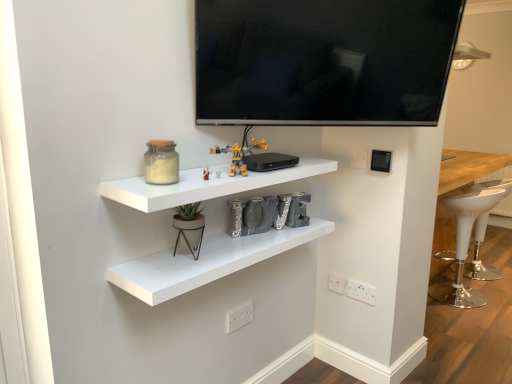
You are a GUI agent. You are given a task and a screenshot of the screen. Output one action in this format:
    pyautogui.click(x=<x>, y=<y>)
    Task: Click on the white plastic bar stool at right, which appears as the second bar stool when viewed from the left
    The image size is (512, 384).
    Given the screenshot: What is the action you would take?
    pyautogui.click(x=478, y=255)

The image size is (512, 384). Find the location of `flat screen tv at upper center`. flat screen tv at upper center is located at coordinates (323, 61).

What is the approximate height of matte white pot at center, which is the 3th toy in top-to-bottom order?

It is 7.45 inches.

Based on the photo, measure the distance between white plastic electric outlet at lower right, acting as the 2th electric outlet starting from the bottom, and camera.

A distance of 1.95 meters exists between white plastic electric outlet at lower right, acting as the 2th electric outlet starting from the bottom, and camera.

Measure the distance between metallic yellow toy at center, the 2th toy when ordered from right to left, and camera.

metallic yellow toy at center, the 2th toy when ordered from right to left, is 4.18 feet from camera.

Measure the distance between yellow plastic toy at center, which is counted as the third toy, starting from the left, and camera.

yellow plastic toy at center, which is counted as the third toy, starting from the left, is 4.62 feet away from camera.

The image size is (512, 384). I want to click on white plastic electric outlet at lower center, the fourth electric outlet when ordered from top to bottom, so (x=239, y=317).

From the image's perspective, would you say translucent glass jar at upper left is positioned over white plastic electric outlet at lower center, the 3th electric outlet positioned from the back?

Actually, translucent glass jar at upper left appears below white plastic electric outlet at lower center, the 3th electric outlet positioned from the back, in the image.

From a real-world perspective, between translucent glass jar at upper left and white plastic electric outlet at lower center, which is the third electric outlet from left to right, who is vertically lower?

white plastic electric outlet at lower center, which is the third electric outlet from left to right, is physically lower.

Is translucent glass jar at upper left at the right side of white plastic electric outlet at lower center, the 3th electric outlet positioned from the back?

In fact, translucent glass jar at upper left is to the left of white plastic electric outlet at lower center, the 3th electric outlet positioned from the back.

From the picture: Is white plastic bar stool at right, marked as the 1th bar stool in a left-to-right arrangement, inside white plastic bar stool at right, which is counted as the first bar stool, starting from the right?

Definitely not — white plastic bar stool at right, marked as the 1th bar stool in a left-to-right arrangement, is not inside white plastic bar stool at right, which is counted as the first bar stool, starting from the right.

Which object is further away from the camera, white plastic bar stool at right, which is counted as the first bar stool, starting from the right, or white plastic bar stool at right, marked as the 1th bar stool in a left-to-right arrangement?

white plastic bar stool at right, which is counted as the first bar stool, starting from the right, is behind.

Where is `bar stool lying on the right of white plastic bar stool at right, which is counted as the second bar stool, starting from the right`? Image resolution: width=512 pixels, height=384 pixels. bar stool lying on the right of white plastic bar stool at right, which is counted as the second bar stool, starting from the right is located at coordinates (478, 255).

Between white plastic bar stool at right, which is counted as the first bar stool, starting from the right, and white plastic bar stool at right, which is counted as the second bar stool, starting from the right, which one appears on the right side from the viewer's perspective?

white plastic bar stool at right, which is counted as the first bar stool, starting from the right, is more to the right.

Is white plastic electric outlet at lower center, acting as the first electric outlet starting from the bottom, far from white plastic electric outlet at lower center, the 3th electric outlet from the right?

No, white plastic electric outlet at lower center, acting as the first electric outlet starting from the bottom, is not far from white plastic electric outlet at lower center, the 3th electric outlet from the right.

Would you say white plastic electric outlet at lower center, which is the 4th electric outlet in front-to-back order, is part of white plastic electric outlet at lower center, marked as the 1th electric outlet in a left-to-right arrangement,'s contents?

No, white plastic electric outlet at lower center, which is the 4th electric outlet in front-to-back order, is not inside white plastic electric outlet at lower center, marked as the 1th electric outlet in a left-to-right arrangement.

From a real-world perspective, is white plastic electric outlet at lower center, which appears as the fourth electric outlet when viewed from the right, over white plastic electric outlet at lower center, positioned as the 3th electric outlet in bottom-to-top order?

No, from a real-world perspective, white plastic electric outlet at lower center, which appears as the fourth electric outlet when viewed from the right, is not on top of white plastic electric outlet at lower center, positioned as the 3th electric outlet in bottom-to-top order.

Which is closer to the camera, (226, 314) or (338, 275)?

The point (226, 314) is in front.

Is white matte shelf at center, the second shelf in the bottom-to-top sequence, turned away from white plastic bar stool at right, which appears as the second bar stool when viewed from the left?

white matte shelf at center, the second shelf in the bottom-to-top sequence, is not turned away from white plastic bar stool at right, which appears as the second bar stool when viewed from the left.

From a real-world perspective, which is physically below, white matte shelf at center, the 1th shelf when ordered from top to bottom, or white plastic bar stool at right, which appears as the second bar stool when viewed from the left?

From a 3D spatial view, white plastic bar stool at right, which appears as the second bar stool when viewed from the left, is below.

Is white matte shelf at center, the 1th shelf when ordered from top to bottom, with white plastic bar stool at right, which appears as the second bar stool when viewed from the left?

They are not placed beside each other.

Can you tell me how much yellow plastic toy at center, which is counted as the third toy, starting from the left, and white matte shelf at center, which ranks as the 2th shelf in top-to-bottom order, differ in facing direction?

2.96 degrees separate the facing orientations of yellow plastic toy at center, which is counted as the third toy, starting from the left, and white matte shelf at center, which ranks as the 2th shelf in top-to-bottom order.

Is yellow plastic toy at center, the 3th toy when ordered from bottom to top, oriented away from white matte shelf at center, the 1th shelf in the bottom-to-top sequence?

No, yellow plastic toy at center, the 3th toy when ordered from bottom to top, is not facing the opposite direction of white matte shelf at center, the 1th shelf in the bottom-to-top sequence.

Where is `toy that is the 1st object to the left of the white matte shelf at center, the 1th shelf in the bottom-to-top sequence, starting at the anchor`? toy that is the 1st object to the left of the white matte shelf at center, the 1th shelf in the bottom-to-top sequence, starting at the anchor is located at coordinates (239, 154).

From a real-world perspective, is yellow plastic toy at center, the 3th toy when ordered from bottom to top, under white matte shelf at center, the 1th shelf in the bottom-to-top sequence?

Answer: No, from a real-world perspective, yellow plastic toy at center, the 3th toy when ordered from bottom to top, is not beneath white matte shelf at center, the 1th shelf in the bottom-to-top sequence.

From the image's perspective, which one is positioned higher, flat screen tv at upper center or white plastic electric outlet at lower center, acting as the first electric outlet starting from the bottom?

flat screen tv at upper center, from the image's perspective.

In order to click on the 4th electric outlet below the flat screen tv at upper center (from the image's perspective) in this screenshot , I will do `click(239, 317)`.

Is flat screen tv at upper center in front of or behind white plastic electric outlet at lower center, acting as the 4th electric outlet starting from the back, in the image?

Visually, flat screen tv at upper center is located in front of white plastic electric outlet at lower center, acting as the 4th electric outlet starting from the back.

From a real-world perspective, is flat screen tv at upper center above or below white plastic electric outlet at lower center, the 1th electric outlet positioned from the front?

In terms of real-world spatial position, flat screen tv at upper center is above white plastic electric outlet at lower center, the 1th electric outlet positioned from the front.

Considering the sizes of white matte shelf at center, the second shelf in the bottom-to-top sequence, and white plastic electric outlet at lower right, arranged as the 3th electric outlet when viewed from the top, in the image, is white matte shelf at center, the second shelf in the bottom-to-top sequence, wider or thinner than white plastic electric outlet at lower right, arranged as the 3th electric outlet when viewed from the top,?

white matte shelf at center, the second shelf in the bottom-to-top sequence, is wider than white plastic electric outlet at lower right, arranged as the 3th electric outlet when viewed from the top.

Which is behind, white matte shelf at center, the second shelf in the bottom-to-top sequence, or white plastic electric outlet at lower right, which is the third electric outlet in front-to-back order?

Positioned behind is white plastic electric outlet at lower right, which is the third electric outlet in front-to-back order.

Is white matte shelf at center, the second shelf in the bottom-to-top sequence, completely or partially outside of white plastic electric outlet at lower right, which is the 1th electric outlet in right-to-left order?

white matte shelf at center, the second shelf in the bottom-to-top sequence, lies outside white plastic electric outlet at lower right, which is the 1th electric outlet in right-to-left order,'s area.

Who is taller, white matte shelf at center, the second shelf in the bottom-to-top sequence, or white plastic electric outlet at lower right, arranged as the 3th electric outlet when viewed from the top?

With more height is white plastic electric outlet at lower right, arranged as the 3th electric outlet when viewed from the top.

Identify the location of glass jar below the white plastic electric outlet at lower center, which is counted as the first electric outlet, starting from the top (from the image's perspective). This screenshot has width=512, height=384. (161, 162).

Find the location of a particular element. The width and height of the screenshot is (512, 384). bar stool that is above the white plastic bar stool at right, marked as the 1th bar stool in a left-to-right arrangement (from a real-world perspective) is located at coordinates (478, 255).

Based on their spatial positions, is white matte shelf at center, the second shelf in the bottom-to-top sequence, or metallic yellow toy at center, positioned as the second toy in top-to-bottom order, further from white plastic bar stool at right, which is counted as the second bar stool, starting from the right?

metallic yellow toy at center, positioned as the second toy in top-to-bottom order, lies further to white plastic bar stool at right, which is counted as the second bar stool, starting from the right, than the other object.

When comparing their distances from yellow plastic toy at center, which is counted as the third toy, starting from the left, does white plastic electric outlet at lower center, which appears as the fourth electric outlet when viewed from the right, or white plastic electric outlet at lower center, the 3th electric outlet from the right, seem closer?

white plastic electric outlet at lower center, which appears as the fourth electric outlet when viewed from the right, is closer to yellow plastic toy at center, which is counted as the third toy, starting from the left.

Estimate the real-world distances between objects in this image. Which object is further from yellow plastic toy at center, the 3th toy when ordered from bottom to top, white plastic electric outlet at lower center, positioned as the 3th electric outlet in bottom-to-top order, or translucent glass jar at upper left?

white plastic electric outlet at lower center, positioned as the 3th electric outlet in bottom-to-top order, is further to yellow plastic toy at center, the 3th toy when ordered from bottom to top.

Considering their positions, is white matte shelf at center, the 1th shelf when ordered from top to bottom, positioned closer to white plastic electric outlet at lower right, which is the 1th electric outlet in right-to-left order, than white plastic bar stool at right, marked as the 1th bar stool in a left-to-right arrangement?

Among the two, white matte shelf at center, the 1th shelf when ordered from top to bottom, is located nearer to white plastic electric outlet at lower right, which is the 1th electric outlet in right-to-left order.

From the image, which object appears to be nearer to white matte shelf at center, the 1th shelf in the bottom-to-top sequence, white plastic electric outlet at lower center, which is counted as the first electric outlet, starting from the top, or white plastic electric outlet at lower center, the second electric outlet from the left?

The object closer to white matte shelf at center, the 1th shelf in the bottom-to-top sequence, is white plastic electric outlet at lower center, which is counted as the first electric outlet, starting from the top.

Estimate the real-world distances between objects in this image. Which object is closer to white plastic electric outlet at lower center, the 3th electric outlet positioned from the back, white plastic electric outlet at lower right, which is the 1th electric outlet in right-to-left order, or white matte shelf at center, which ranks as the 2th shelf in top-to-bottom order?

The object closer to white plastic electric outlet at lower center, the 3th electric outlet positioned from the back, is white plastic electric outlet at lower right, which is the 1th electric outlet in right-to-left order.

Estimate the real-world distances between objects in this image. Which object is further from metallic yellow toy at center, the 2th toy when ordered from right to left, flat screen tv at upper center or translucent glass jar at upper left?

flat screen tv at upper center.

Looking at the image, which one is located closer to white plastic electric outlet at lower right, which is the third electric outlet in front-to-back order, white plastic electric outlet at lower center, the second electric outlet from the left, or white plastic electric outlet at lower center, which is counted as the first electric outlet, starting from the top?

white plastic electric outlet at lower center, the second electric outlet from the left, lies closer to white plastic electric outlet at lower right, which is the third electric outlet in front-to-back order, than the other object.

The image size is (512, 384). In order to click on television located between translucent glass jar at upper left and white plastic electric outlet at lower center, which is the 4th electric outlet in front-to-back order, in the depth direction in this screenshot , I will do `click(323, 61)`.

I want to click on toy between white matte shelf at center, the second shelf in the bottom-to-top sequence, and white matte shelf at center, which ranks as the 2th shelf in top-to-bottom order, vertically, so click(189, 227).

Image resolution: width=512 pixels, height=384 pixels. Identify the location of television situated between translucent glass jar at upper left and white plastic bar stool at right, which is counted as the first bar stool, starting from the right, from left to right. (323, 61).

The image size is (512, 384). What are the coordinates of `shelf located between white matte shelf at center, the second shelf in the bottom-to-top sequence, and white plastic electric outlet at lower center, acting as the 4th electric outlet starting from the back, in the depth direction` in the screenshot? It's located at (206, 262).